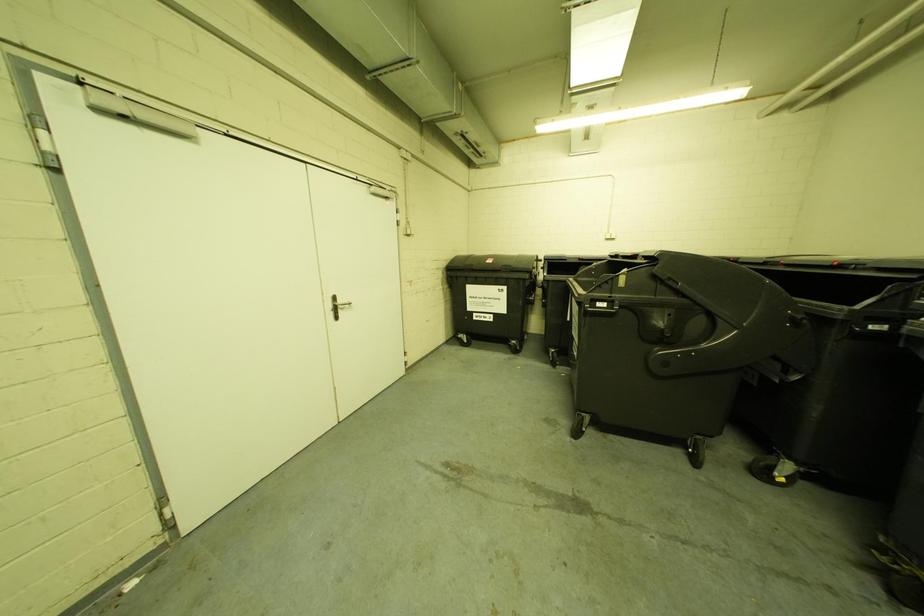
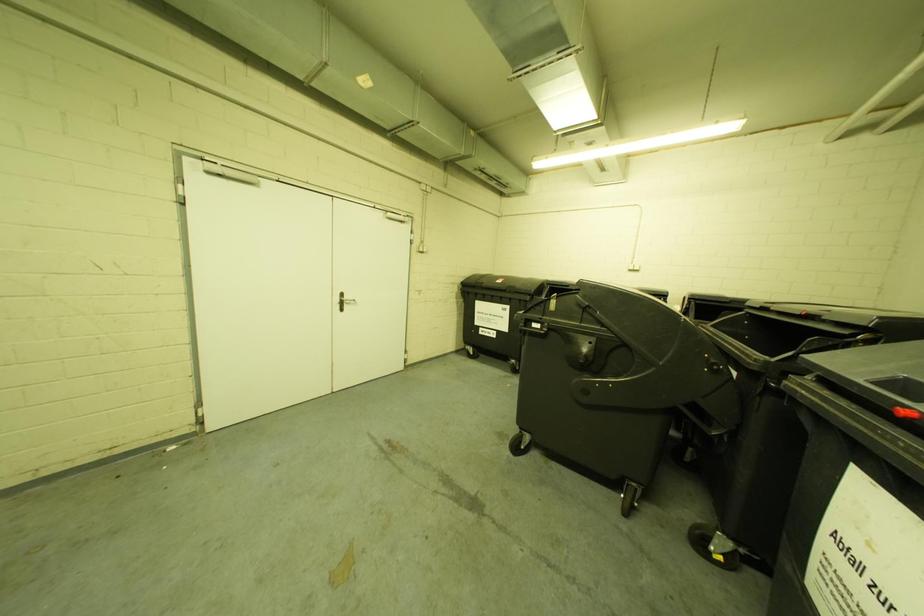
Question: Which direction would the cameraman need to move to produce the second image? Reply with the corresponding letter.

Choices:
 (A) Left
 (B) Right
 (C) Forward
 (D) Backward

Answer: (B)